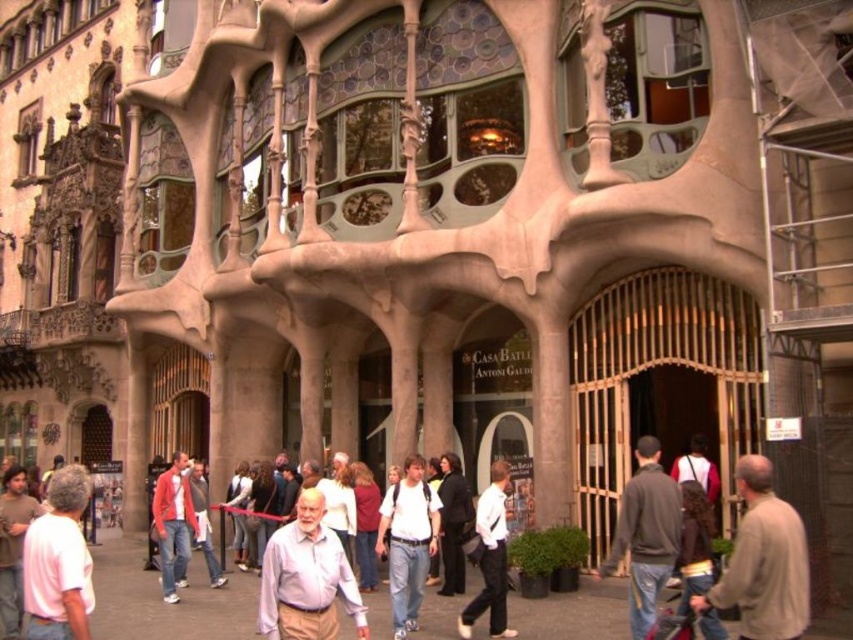
Question: Which of the following is the closest to the observer?

Choices:
 (A) brown leather jacket at lower right
 (B) light purple shirt at center
 (C) light blue shirt at center
 (D) gray cotton shirt at lower left

Answer: (A)

Question: Does light blue shirt at center have a greater width compared to matte red jacket at lower left?

Choices:
 (A) no
 (B) yes

Answer: (B)

Question: Does white matte shirt at center have a smaller size compared to matte red jacket at lower left?

Choices:
 (A) yes
 (B) no

Answer: (B)

Question: Among these points, which one is farthest from the camera?

Choices:
 (A) (653, 442)
 (B) (412, 561)
 (C) (346, 593)

Answer: (B)

Question: Which of these objects is positioned closest to the light blue shirt at center?

Choices:
 (A) gray cotton shirt at lower left
 (B) dark gray sweater at center
 (C) light purple shirt at center

Answer: (C)

Question: Considering the relative positions of white matte shirt at center and gray cotton shirt at lower left in the image provided, where is white matte shirt at center located with respect to gray cotton shirt at lower left?

Choices:
 (A) right
 (B) left

Answer: (A)